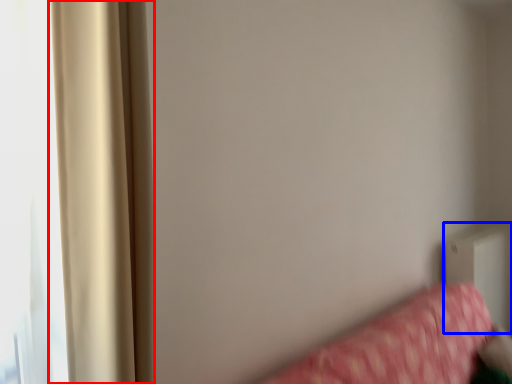
Question: Which object is further to the camera taking this photo, curtain (highlighted by a red box) or radiator (highlighted by a blue box)?

Choices:
 (A) curtain
 (B) radiator

Answer: (B)